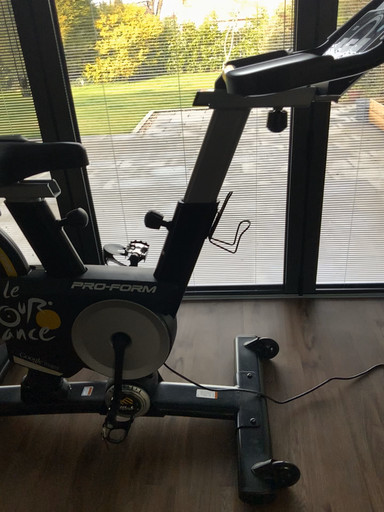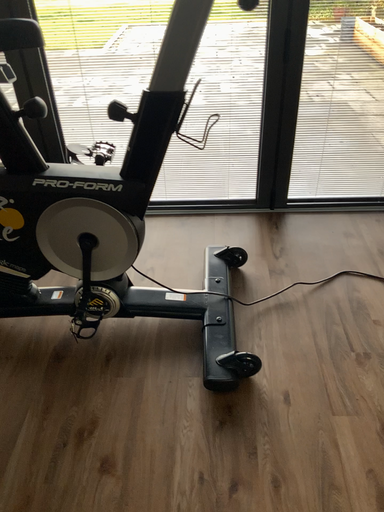
Question: Which way did the camera rotate in the video?

Choices:
 (A) rotated upward
 (B) rotated downward

Answer: (B)